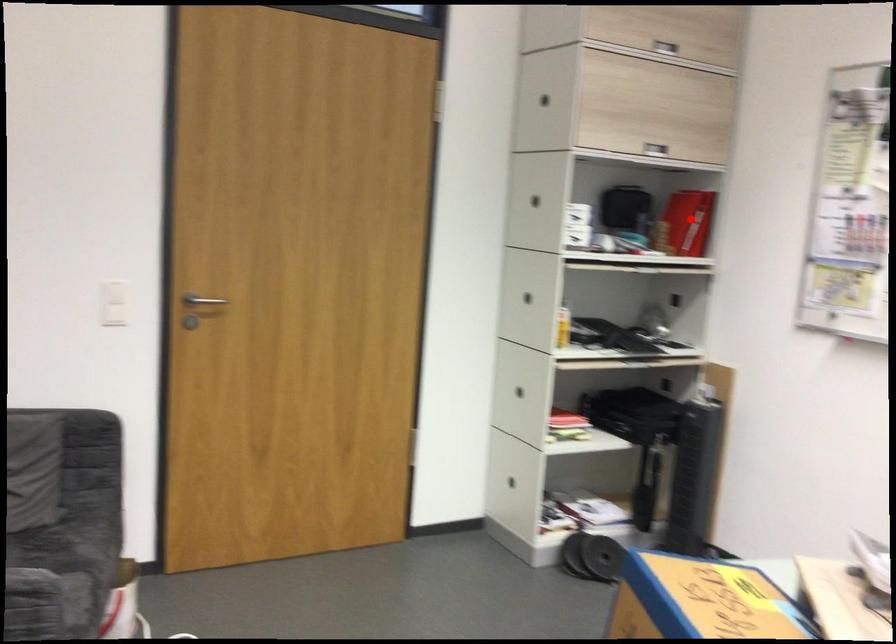
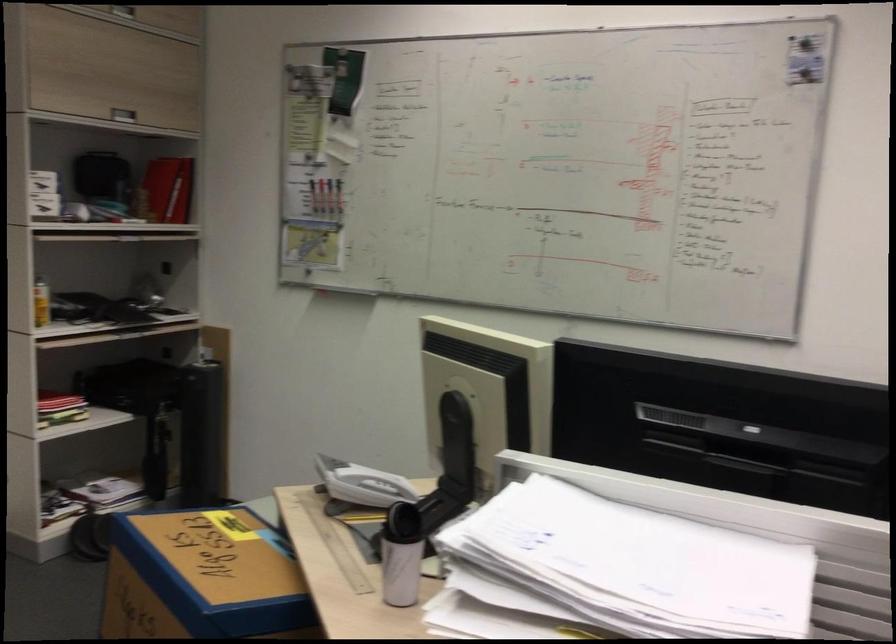
Question: I am providing you with two images of the same scene from different viewpoints. A red point is marked on the first image. At the location where the point appears in image 1, is it still visible in image 2?

Choices:
 (A) Yes
 (B) No

Answer: (A)